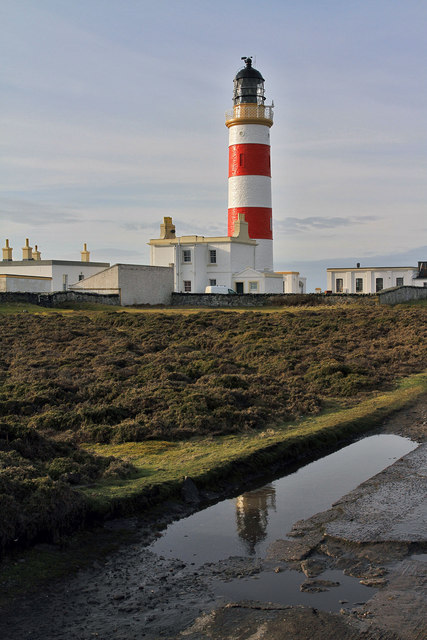
I want to click on door, so click(241, 287).